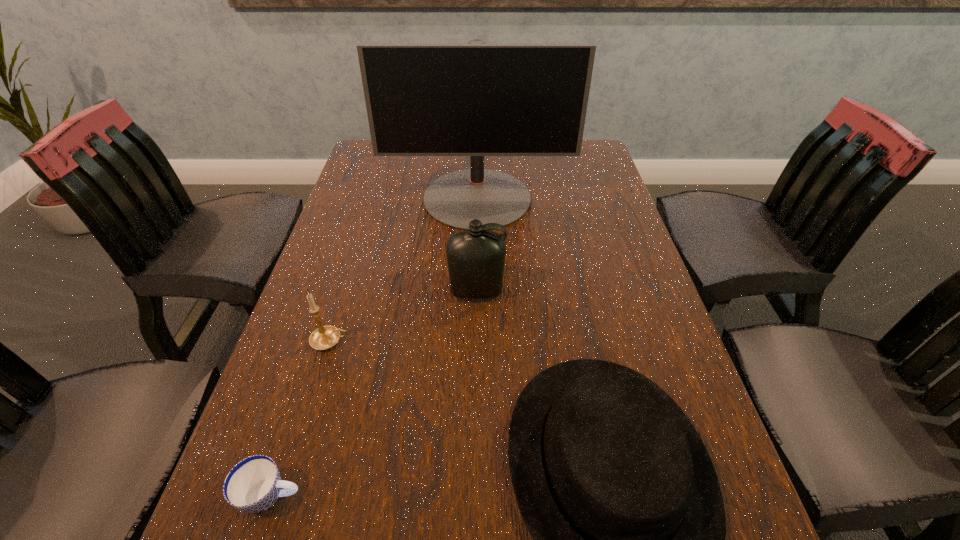
Where is `computer monitor`? The width and height of the screenshot is (960, 540). computer monitor is located at coordinates (476, 99).

Locate an element on the screen. The height and width of the screenshot is (540, 960). the tallest object is located at coordinates (476, 99).

The image size is (960, 540). Identify the location of the fourth nearest object. (476, 258).

Where is `bottle`? bottle is located at coordinates (476, 258).

Where is `the third farthest object`? the third farthest object is located at coordinates (325, 337).

Locate an element on the screen. This screenshot has width=960, height=540. candle holder is located at coordinates (325, 337).

You are a GUI agent. You are given a task and a screenshot of the screen. Output one action in this format:
    pyautogui.click(x=<x>, y=<y>)
    Task: Click on the shortest object
    Image resolution: width=960 pixels, height=540 pixels.
    Given the screenshot: What is the action you would take?
    pyautogui.click(x=253, y=485)

At what (x,y) coordinates should I click in order to perform the action: click on vacant space located 0.090m on the screen of the tallest object. Please return your answer as a coordinate pair (x, y). The height and width of the screenshot is (540, 960). Looking at the image, I should click on (477, 254).

Where is `free space located 0.160m on the back of the second farthest object`? free space located 0.160m on the back of the second farthest object is located at coordinates (477, 236).

Identify the location of vacant space situated 0.300m on the handle side of the candle holder. point(498,341).